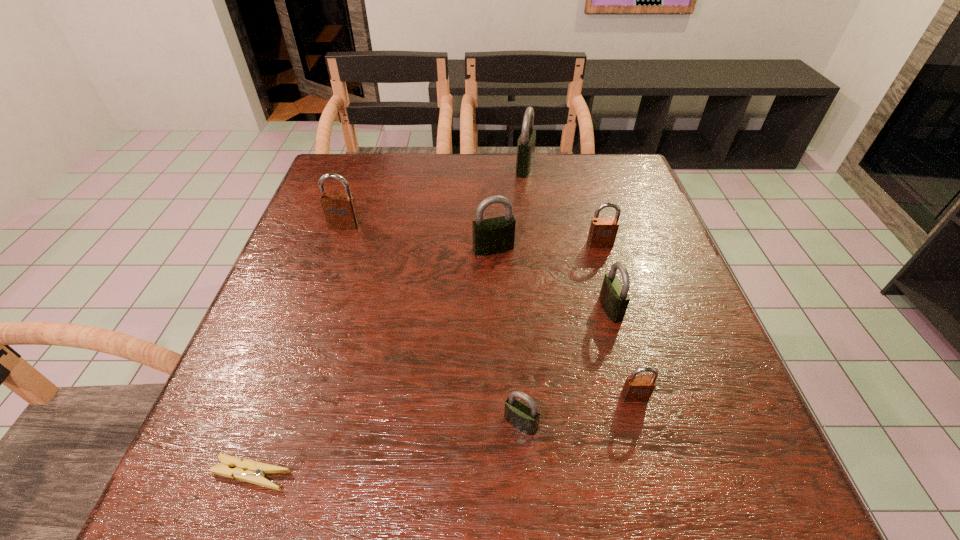
Locate an element on the screen. the fourth padlock from right to left is located at coordinates (526, 143).

The image size is (960, 540). What are the coordinates of `the farthest black padlock` in the screenshot? It's located at (526, 143).

Where is `the third nearest black padlock`? the third nearest black padlock is located at coordinates (491, 236).

The height and width of the screenshot is (540, 960). Find the location of `the biggest brown padlock`. the biggest brown padlock is located at coordinates (340, 211).

This screenshot has height=540, width=960. Identify the location of the farthest brown padlock. (340, 211).

Locate an element on the screen. This screenshot has height=540, width=960. the second biggest brown padlock is located at coordinates (603, 231).

You are a GUI agent. You are given a task and a screenshot of the screen. Output one action in this format:
    pyautogui.click(x=<x>, y=<y>)
    Task: Click on the second smallest black padlock
    
    Given the screenshot: What is the action you would take?
    pyautogui.click(x=614, y=298)

Locate an element on the screen. The width and height of the screenshot is (960, 540). the second nearest black padlock is located at coordinates (614, 298).

Identify the location of the smallest black padlock. The image size is (960, 540). (525, 418).

Locate an element on the screen. the seventh farthest object is located at coordinates (525, 418).